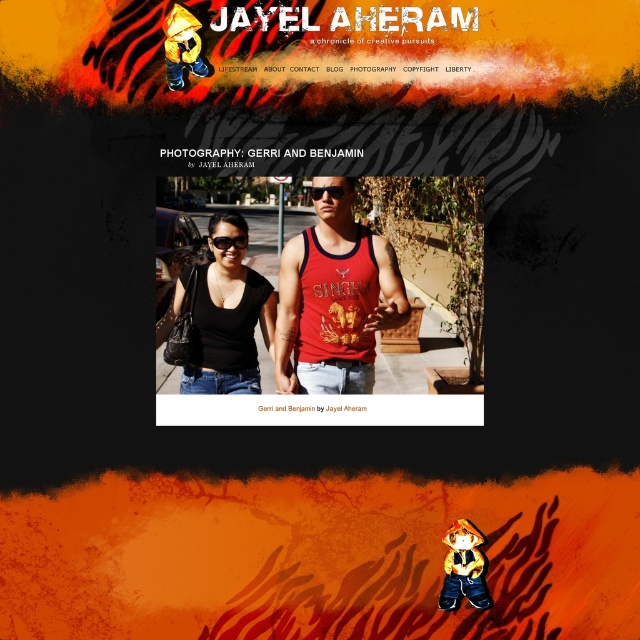
You are viewing the webpage for JAYEL AHERAM. There are two points on the page at coordinates point (317, 307) and point (339, 317). If you were to move your cursor from the first point to the second, would you be moving closer to or farther from the camera?

Moving from point (317, 307) to point (339, 317) would take you farther from the camera because point (317, 307) is closer to the camera than point (339, 317).

Consider the image. You are designing a virtual fitting room for a clothing brand. You need to display two items, the matte red tank top at center and the red cotton singh vest at center, side by side. Given their sizes, which one should be placed on the left to maintain visual balance?

The matte red tank top at center should be placed on the left because its width is larger than the red cotton singh vest at center, creating a balanced arrangement.

You are designing a website layout and need to place two accessories, the black plastic goggles at center and the black plastic sunglasses at center, in a way that maintains their current spatial relationship. If you decide to move the sunglasses to the right side of the page, where should you place the goggles to keep their original positioning relative to each other?

The black plastic goggles at center should be placed to the left of the black plastic sunglasses at center to maintain their original spatial relationship where the goggles were positioned on the left side of the sunglasses.